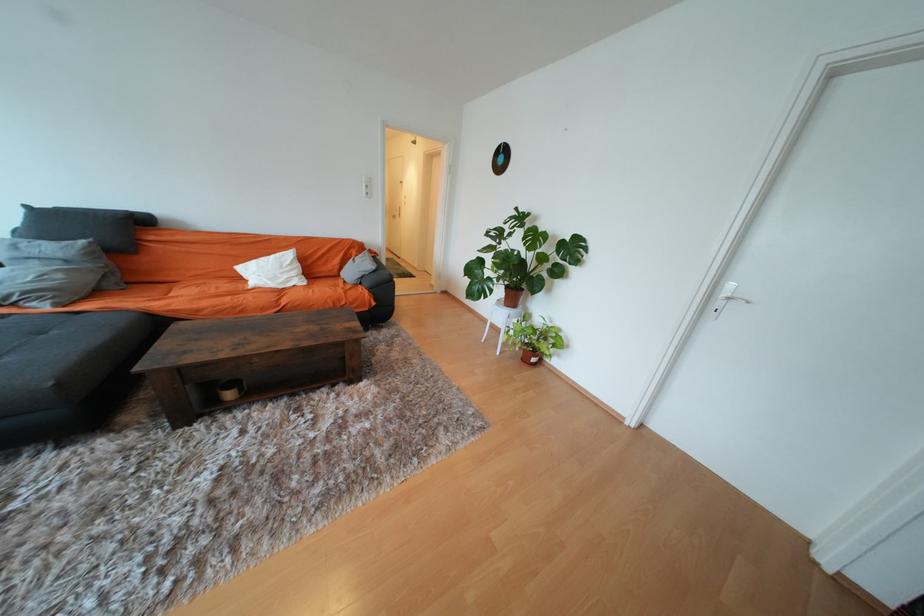
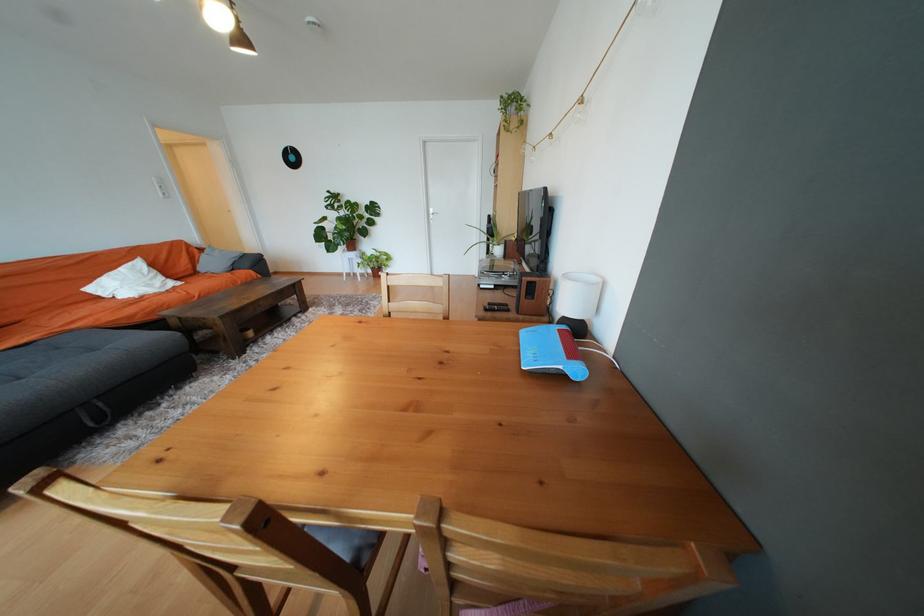
The point at [736,286] is marked in the first image. Where is the corresponding point in the second image?

(438, 211)